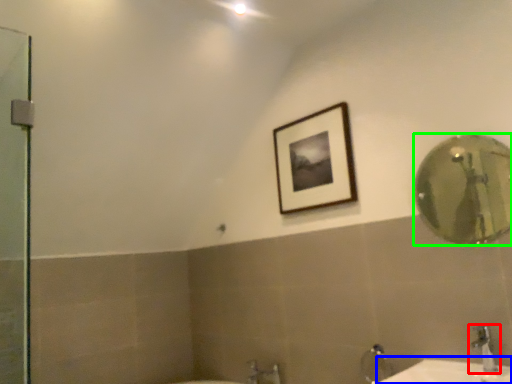
Question: Estimate the real-world distances between objects in this image. Which object is closer to tap (highlighted by a red box), counter top (highlighted by a blue box) or mirror (highlighted by a green box)?

Choices:
 (A) counter top
 (B) mirror

Answer: (A)